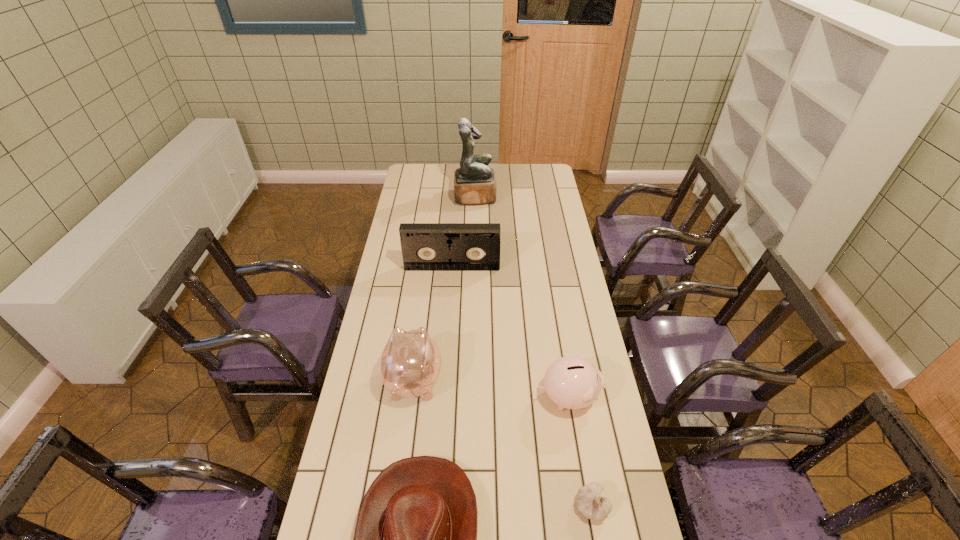
In the image, there is a desktop. What are the coordinates of `vacant space at the left edge` in the screenshot? It's located at (416, 314).

In the image, there is a desktop. At what (x,y) coordinates should I click in order to perform the action: click on free space at the right edge. Please return your answer as a coordinate pair (x, y). This screenshot has height=540, width=960. Looking at the image, I should click on (576, 276).

Locate an element on the screen. This screenshot has width=960, height=540. vacant area at the far left corner of the desktop is located at coordinates (420, 168).

Image resolution: width=960 pixels, height=540 pixels. What are the coordinates of `vacant space at the far right corner of the desktop` in the screenshot? It's located at (524, 176).

I want to click on free space between the shorter piggy bank and the garlic, so click(579, 451).

Identify the location of free space that is in between the videotape and the right piggy bank. The height and width of the screenshot is (540, 960). pos(510,332).

You are a GUI agent. You are given a task and a screenshot of the screen. Output one action in this format:
    pyautogui.click(x=<x>, y=<y>)
    Task: Click on the unoccupied position between the sculpture and the right piggy bank
    Image resolution: width=960 pixels, height=540 pixels.
    Given the screenshot: What is the action you would take?
    pyautogui.click(x=521, y=296)

Locate an element on the screen. The width and height of the screenshot is (960, 540). free space between the left piggy bank and the right piggy bank is located at coordinates click(x=491, y=388).

Locate an element on the screen. free space between the fifth nearest object and the taller piggy bank is located at coordinates (433, 323).

Find the location of a particular element. object that is the closest one to the taller piggy bank is located at coordinates (415, 539).